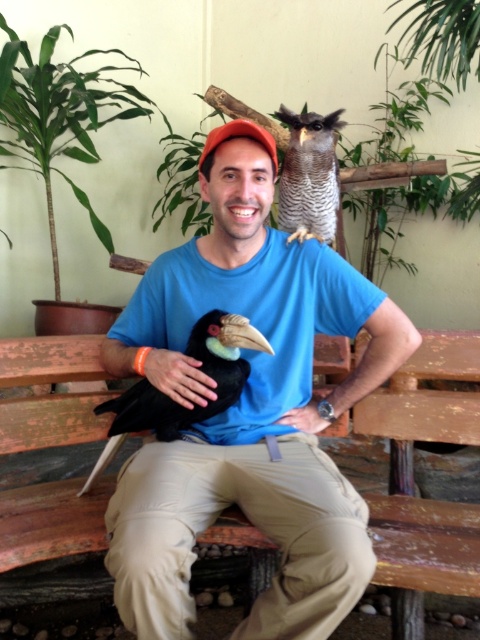
You are a photographer taking a picture of the two birds on the man. The birds are located at point coordinates point [355,326] and point [300,408]. Which bird is closer to the camera?

Point [355,326] is in front of point [300,408], so the bird at point [355,326] is closer to the camera.

In the scene shown: You are a photographer trying to capture a closeup of the blue fabric shirt at center and the matte black hand at center. Which object should you focus on first to ensure it appears sharp in your photo?

The blue fabric shirt at center is closer to the viewer than the matte black hand at center, so you should focus on the blue fabric shirt at center first to ensure it appears sharp.

You are a tailor measuring the distance between the blue fabric shirt at center and the matte black hand at center for a custom fitting. The minimum required distance for proper adjustment is 14 inches. Can the tailor proceed with the current measurement?

The blue fabric shirt at center and matte black hand at center are 14.05 inches apart, which is just over the 14 inch requirement. The tailor can proceed with the current measurement.